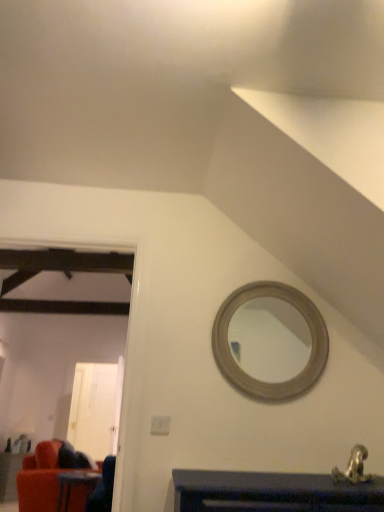
Where is `white glossy door at left`? white glossy door at left is located at coordinates (96, 408).

Measure the distance between point (8, 466) and camera.

Point (8, 466) and camera are 4.69 meters apart from each other.

Locate an element on the screen. Image resolution: width=384 pixels, height=512 pixels. velvet red couch at lower left, the first table in the bottom-to-top sequence is located at coordinates (12, 473).

This screenshot has height=512, width=384. What do you see at coordinates (354, 467) in the screenshot?
I see `metallic silver faucet at lower right` at bounding box center [354, 467].

The width and height of the screenshot is (384, 512). Identify the location of metallic silver faucet at lower right. (354, 467).

Image resolution: width=384 pixels, height=512 pixels. In order to click on white glossy door at left in this screenshot , I will do `click(96, 408)`.

Who is bigger, white glossy door at left or metallic silver faucet at lower right?

white glossy door at left is bigger.

Would you say white glossy door at left is inside or outside metallic silver faucet at lower right?

The correct answer is: outside.

How different are the orientations of white glossy door at left and metallic silver faucet at lower right in degrees?

0.614 degrees.

From the image's perspective, is white glossy door at left located beneath metallic silver faucet at lower right?

Indeed, from the image's perspective, white glossy door at left is shown beneath metallic silver faucet at lower right.

Does point (79, 439) come behind point (15, 454)?

Yes, point (79, 439) is farther from viewer.

Which is more to the right, white glossy door at left or velvet red couch at lower left, acting as the 2th table starting from the front?

Positioned to the right is white glossy door at left.

Is velvet red couch at lower left, acting as the second table starting from the right, completely or partially inside white glossy door at left?

No, velvet red couch at lower left, acting as the second table starting from the right, is not a part of white glossy door at left.

Which of these two, metallic silver faucet at lower right or velvet red couch at lower left, placed as the first table when sorted from left to right, is thinner?

metallic silver faucet at lower right is thinner.

Based on the photo, what's the angular difference between metallic silver faucet at lower right and velvet red couch at lower left, arranged as the 1th table when viewed from the back,'s facing directions?

The angular difference between metallic silver faucet at lower right and velvet red couch at lower left, arranged as the 1th table when viewed from the back, is 45.7 degrees.

From the image's perspective, which one is positioned higher, metallic silver faucet at lower right or velvet red couch at lower left, the first table in the bottom-to-top sequence?

From the image's view, metallic silver faucet at lower right is above.

Consider the image. Does metallic silver faucet at lower right contain velvet red couch at lower left, placed as the first table when sorted from left to right?

No, velvet red couch at lower left, placed as the first table when sorted from left to right, is not a part of metallic silver faucet at lower right.

Is white glossy door at left at the back of metallic silver faucet at lower right?

Yes, metallic silver faucet at lower right is positioned with its back facing white glossy door at left.

Is metallic silver faucet at lower right to the right of white glossy door at left from the viewer's perspective?

Yes, metallic silver faucet at lower right is to the right of white glossy door at left.

From the image's perspective, is metallic silver faucet at lower right located above or below white glossy door at left?

Clearly, from the image's perspective, metallic silver faucet at lower right is above white glossy door at left.

Considering the sizes of objects metallic silver faucet at lower right and white glossy door at left in the image provided, who is taller, metallic silver faucet at lower right or white glossy door at left?

white glossy door at left.

Does velvet red couch at lower left, acting as the second table starting from the right, appear on the right side of metallic silver faucet at lower right?

Incorrect, velvet red couch at lower left, acting as the second table starting from the right, is not on the right side of metallic silver faucet at lower right.

Does velvet red couch at lower left, arranged as the 1th table when viewed from the back, lie in front of metallic silver faucet at lower right?

No.

Who is smaller, velvet red couch at lower left, placed as the 2th table when sorted from top to bottom, or metallic silver faucet at lower right?

Smaller between the two is metallic silver faucet at lower right.

From the image's perspective, is velvet red couch at lower left, acting as the 2th table starting from the front, beneath metallic silver faucet at lower right?

Indeed, from the image's perspective, velvet red couch at lower left, acting as the 2th table starting from the front, is shown beneath metallic silver faucet at lower right.

Is white glossy door at left taller than wooden table at lower left, acting as the first table starting from the front?

Yes, white glossy door at left is taller than wooden table at lower left, acting as the first table starting from the front.

Based on the photo, between white glossy door at left and wooden table at lower left, placed as the 1th table when sorted from top to bottom, which one has smaller size?

Smaller between the two is wooden table at lower left, placed as the 1th table when sorted from top to bottom.

Is white glossy door at left spatially inside wooden table at lower left, the first table when ordered from right to left, or outside of it?

white glossy door at left is located beyond the bounds of wooden table at lower left, the first table when ordered from right to left.

Are velvet red couch at lower left, acting as the 2th table starting from the front, and white glossy door at left far apart?

That's right, there is a large distance between velvet red couch at lower left, acting as the 2th table starting from the front, and white glossy door at left.

Is velvet red couch at lower left, acting as the second table starting from the right, situated inside white glossy door at left or outside?

velvet red couch at lower left, acting as the second table starting from the right, cannot be found inside white glossy door at left.

Can you tell me how much velvet red couch at lower left, placed as the 2th table when sorted from top to bottom, and white glossy door at left differ in facing direction?

The angle between the facing direction of velvet red couch at lower left, placed as the 2th table when sorted from top to bottom, and the facing direction of white glossy door at left is 45 degrees.

The image size is (384, 512). What are the coordinates of `glass door on the left of metallic silver faucet at lower right` in the screenshot? It's located at click(96, 408).

You are a GUI agent. You are given a task and a screenshot of the screen. Output one action in this format:
    pyautogui.click(x=<x>, y=<y>)
    Task: Click on the glass door that appears above the velvet red couch at lower left, the first table in the bottom-to-top sequence (from the image's perspective)
    This screenshot has width=384, height=512.
    Given the screenshot: What is the action you would take?
    pyautogui.click(x=96, y=408)

From the image, which object appears to be nearer to white glossy door at left, wooden table at lower left, acting as the first table starting from the front, or metallic silver faucet at lower right?

wooden table at lower left, acting as the first table starting from the front, lies closer to white glossy door at left than the other object.

Estimate the real-world distances between objects in this image. Which object is closer to metallic silver faucet at lower right, wooden table at lower left, which ranks as the 2th table in left-to-right order, or white glossy door at left?

The object closer to metallic silver faucet at lower right is wooden table at lower left, which ranks as the 2th table in left-to-right order.

When comparing their distances from metallic silver faucet at lower right, does white glossy door at left or velvet red couch at lower left, acting as the second table starting from the right, seem further?

white glossy door at left is positioned further to the anchor metallic silver faucet at lower right.

When comparing their distances from white glossy door at left, does velvet red couch at lower left, the first table in the bottom-to-top sequence, or metallic silver faucet at lower right seem further?

metallic silver faucet at lower right is further to white glossy door at left.

When comparing their distances from white glossy door at left, does metallic silver faucet at lower right or wooden table at lower left, arranged as the second table when viewed from the back, seem further?

Based on the image, metallic silver faucet at lower right appears to be further to white glossy door at left.

Which object lies further to the anchor point wooden table at lower left, placed as the 1th table when sorted from top to bottom, white glossy door at left or metallic silver faucet at lower right?

metallic silver faucet at lower right lies further to wooden table at lower left, placed as the 1th table when sorted from top to bottom, than the other object.

Looking at the image, which one is located further to metallic silver faucet at lower right, wooden table at lower left, acting as the first table starting from the front, or velvet red couch at lower left, placed as the 2th table when sorted from top to bottom?

velvet red couch at lower left, placed as the 2th table when sorted from top to bottom, lies further to metallic silver faucet at lower right than the other object.

From the image, which object appears to be nearer to velvet red couch at lower left, the first table in the bottom-to-top sequence, white glossy door at left or wooden table at lower left, placed as the 1th table when sorted from top to bottom?

The object closer to velvet red couch at lower left, the first table in the bottom-to-top sequence, is wooden table at lower left, placed as the 1th table when sorted from top to bottom.

This screenshot has width=384, height=512. I want to click on table located between metallic silver faucet at lower right and velvet red couch at lower left, placed as the 2th table when sorted from top to bottom, in the depth direction, so click(75, 484).

The width and height of the screenshot is (384, 512). In order to click on table between wooden table at lower left, the 2th table in the bottom-to-top sequence, and white glossy door at left, along the z-axis in this screenshot , I will do `click(12, 473)`.